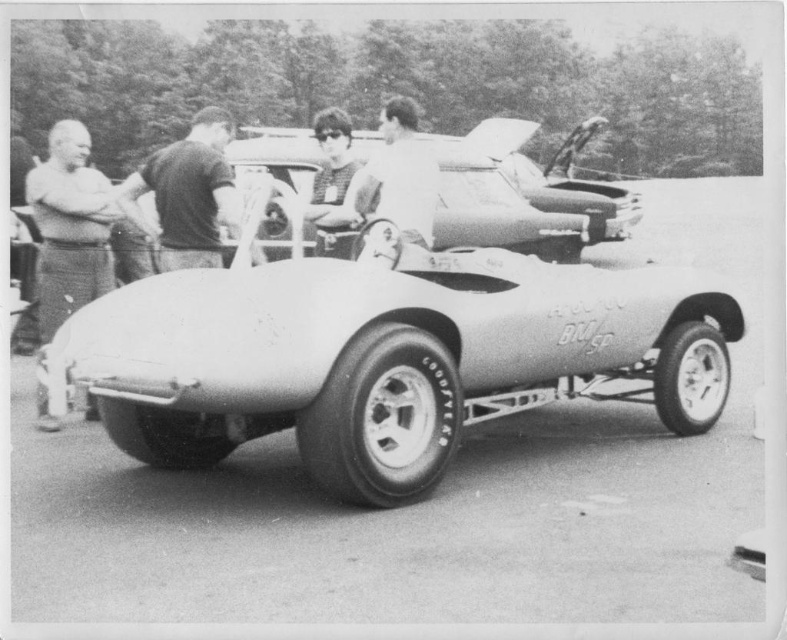
This screenshot has height=640, width=787. I want to click on metallic silver sports car at center, so click(x=386, y=356).

Is metallic silver sports car at center to the left of shiny metallic car at center from the viewer's perspective?

In fact, metallic silver sports car at center is to the right of shiny metallic car at center.

Find the location of a particular element. metallic silver sports car at center is located at coordinates (386, 356).

Which is more to the left, shiny metallic car at center or smooth leather jacket at center?

From the viewer's perspective, smooth leather jacket at center appears more on the left side.

Describe the element at coordinates (523, 196) in the screenshot. This screenshot has width=787, height=640. I see `shiny metallic car at center` at that location.

Is point (538, 209) behind point (416, 240)?

Yes, it is.

Find the location of `shiny metallic car at center`. shiny metallic car at center is located at coordinates (523, 196).

Which is above, shiny metallic car at center or dark gray shirt at center?

Positioned higher is shiny metallic car at center.

Who is more forward, [575,260] or [216,228]?

Positioned in front is point [216,228].

Does point (279, 246) lie in front of point (137, 216)?

No, (279, 246) is further to viewer.

This screenshot has height=640, width=787. What are the coordinates of `shiny metallic car at center` in the screenshot? It's located at (523, 196).